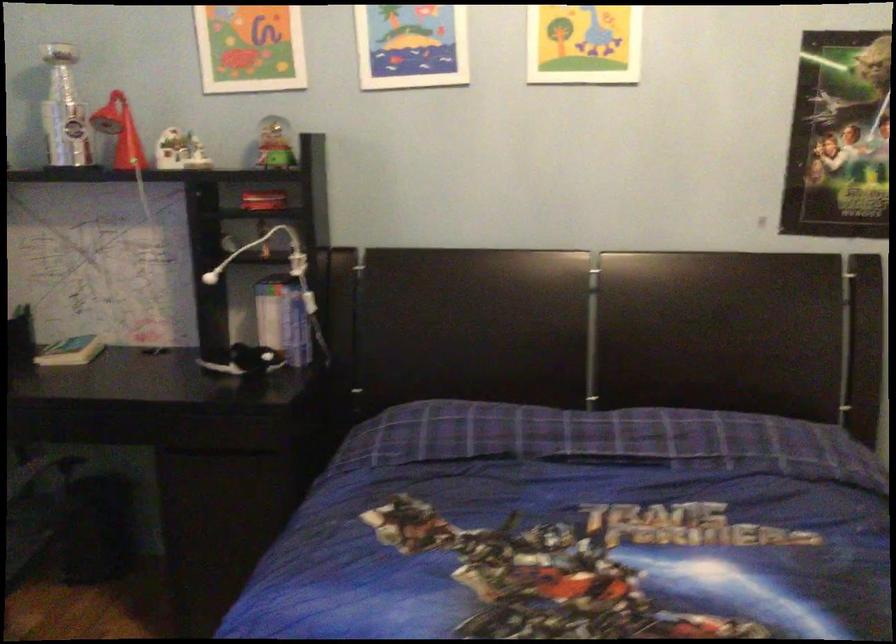
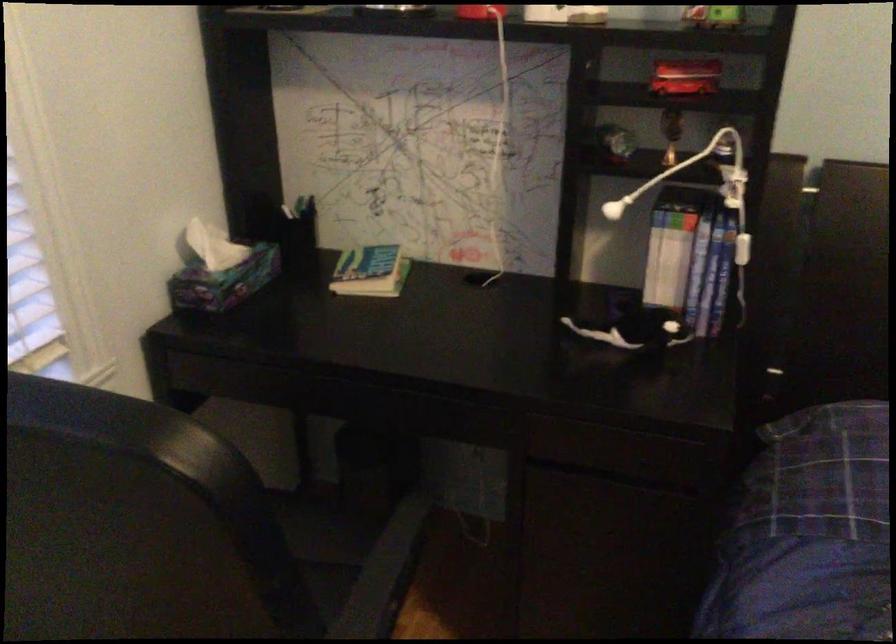
In the second image, find the point that corresponds to point (273, 156) in the first image.

(713, 17)